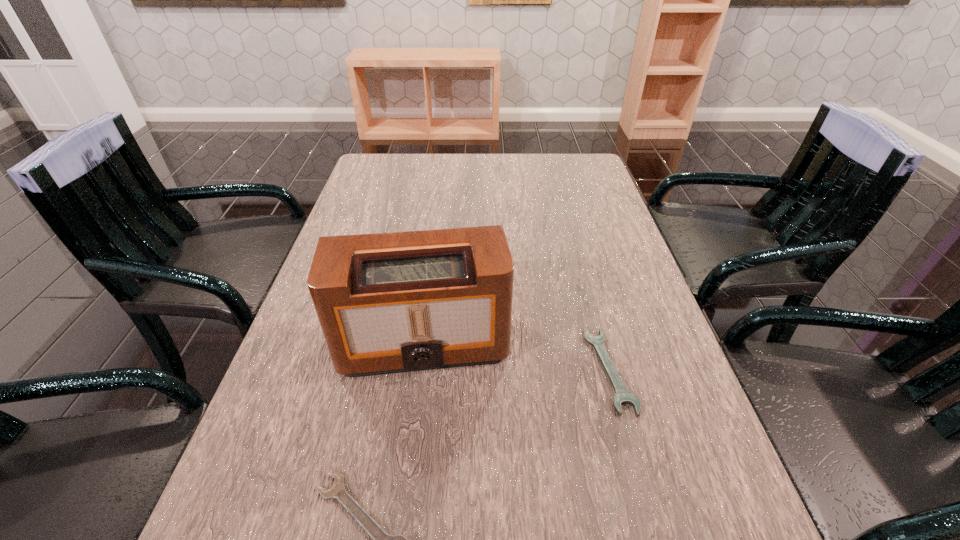
Image resolution: width=960 pixels, height=540 pixels. In order to click on vacant space at the far right corner of the desktop in this screenshot , I will do `click(555, 176)`.

The width and height of the screenshot is (960, 540). I want to click on vacant point located between the right wrench and the tallest object, so click(x=516, y=356).

At what (x,y) coordinates should I click in order to perform the action: click on object that is the closest to the farther wrench. Please return your answer as a coordinate pair (x, y). This screenshot has width=960, height=540. Looking at the image, I should click on (395, 302).

Identify which object is the second closest to the radio receiver. Please provide its 2D coordinates. Your answer should be formatted as a tuple, i.e. [(x, y)], where the tuple contains the x and y coordinates of a point satisfying the conditions above.

[(381, 539)]

Identify the location of free region that satisfies the following two spatial constraints: 1. on the front side of the tallest object; 2. on the right side of the right wrench. (420, 370).